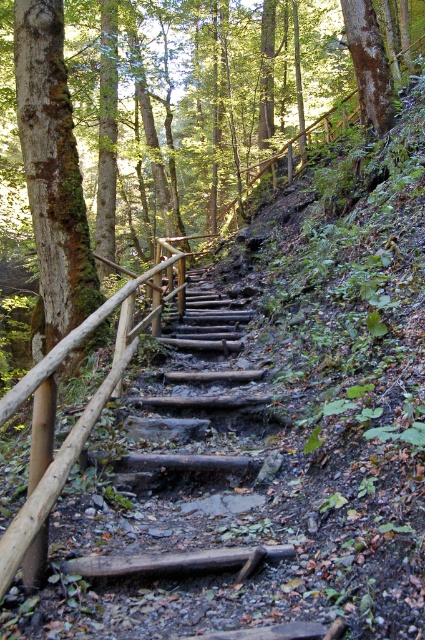
Question: From the image, what is the correct spatial relationship of green mossy bark tree at left in relation to brown wooden rail at left?

Choices:
 (A) left
 (B) right

Answer: (A)

Question: Among these objects, which one is nearest to the camera?

Choices:
 (A) brown wooden rail at left
 (B) green mossy bark tree at left

Answer: (B)

Question: Can you confirm if green mossy bark tree at left is smaller than rustic wooden stairs at center?

Choices:
 (A) yes
 (B) no

Answer: (B)

Question: Which point is farther to the camera?

Choices:
 (A) (20, 513)
 (B) (34, 84)
 (C) (189, 436)

Answer: (B)

Question: Can you confirm if rustic wooden stairs at center is bigger than brown wooden rail at left?

Choices:
 (A) yes
 (B) no

Answer: (A)

Question: Which point is farther to the camera?

Choices:
 (A) (42, 0)
 (B) (11, 573)
 (C) (170, 336)

Answer: (C)